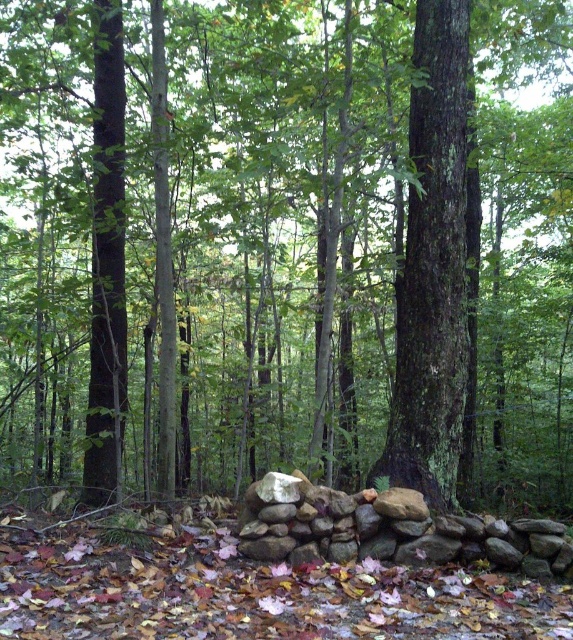
How distant is smooth bark tree at center from brown rough stone wall at center?

smooth bark tree at center is 1.13 meters away from brown rough stone wall at center.

Does smooth bark tree at center have a larger size compared to brown rough stone wall at center?

Indeed, smooth bark tree at center has a larger size compared to brown rough stone wall at center.

Image resolution: width=573 pixels, height=640 pixels. Find the location of `smooth bark tree at center`. smooth bark tree at center is located at coordinates (433, 266).